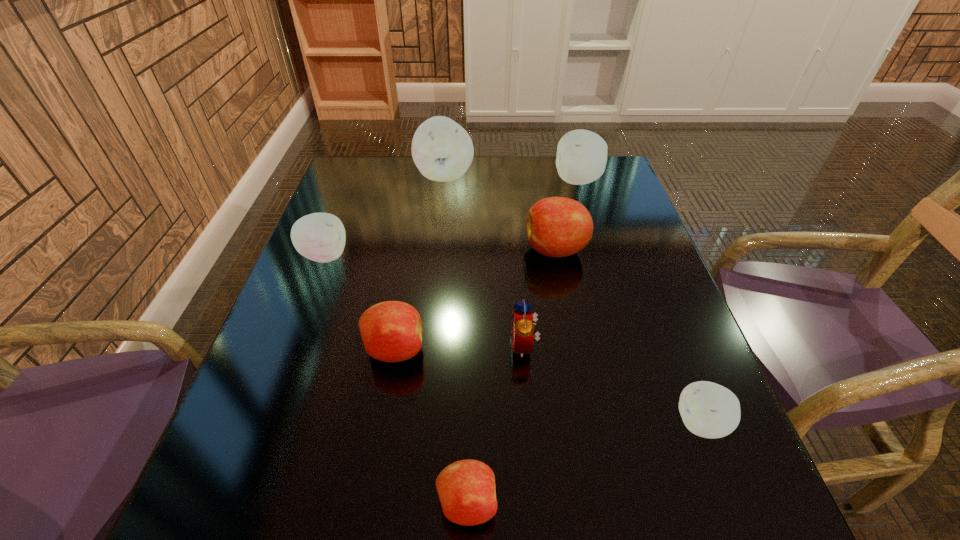
The image size is (960, 540). What are the coordinates of `free space located on the front-facing side of the alarm clock` in the screenshot? It's located at (396, 345).

The image size is (960, 540). I want to click on free space located 0.220m on the back of the third nearest apple, so click(x=410, y=257).

Identify the location of vacant position located 0.300m on the left of the second nearest object. This screenshot has height=540, width=960. (503, 423).

What are the coordinates of `free point located 0.190m on the right of the smallest red apple` in the screenshot? It's located at (622, 503).

Locate an element on the screen. The width and height of the screenshot is (960, 540). object that is at the near edge is located at coordinates pos(466,488).

This screenshot has height=540, width=960. I want to click on object at the left edge, so click(x=320, y=237).

Where is `object that is at the far right corner`? object that is at the far right corner is located at coordinates (581, 158).

Where is `vacant space at the far edge of the desktop`? Image resolution: width=960 pixels, height=540 pixels. vacant space at the far edge of the desktop is located at coordinates (432, 180).

Image resolution: width=960 pixels, height=540 pixels. In the image, there is a desktop. Find the location of `vacant space at the near edge`. vacant space at the near edge is located at coordinates (336, 536).

At what (x,y) coordinates should I click in order to perform the action: click on blank space at the left edge. Please return your answer as a coordinate pair (x, y). Looking at the image, I should click on (348, 301).